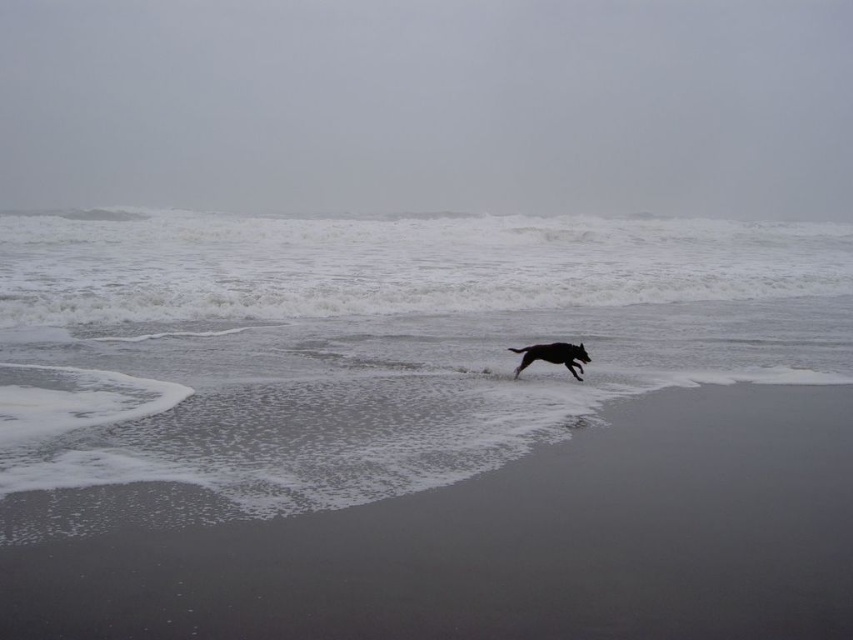
Can you confirm if gray sand at lower center is wider than black glossy dog at center?

Correct, the width of gray sand at lower center exceeds that of black glossy dog at center.

Is gray sand at lower center closer to camera compared to black glossy dog at center?

Yes, it is.

Locate an element on the screen. Image resolution: width=853 pixels, height=640 pixels. gray sand at lower center is located at coordinates (509, 545).

Between white frothy water at center and black glossy dog at center, which one is positioned lower?

Positioned lower is black glossy dog at center.

Does white frothy water at center have a larger size compared to black glossy dog at center?

Yes.

Is point (473, 243) behind point (573, 376)?

Yes, point (473, 243) is behind point (573, 376).

Locate an element on the screen. Image resolution: width=853 pixels, height=640 pixels. white frothy water at center is located at coordinates (369, 344).

The height and width of the screenshot is (640, 853). What are the coordinates of `white frothy water at center` in the screenshot? It's located at (369, 344).